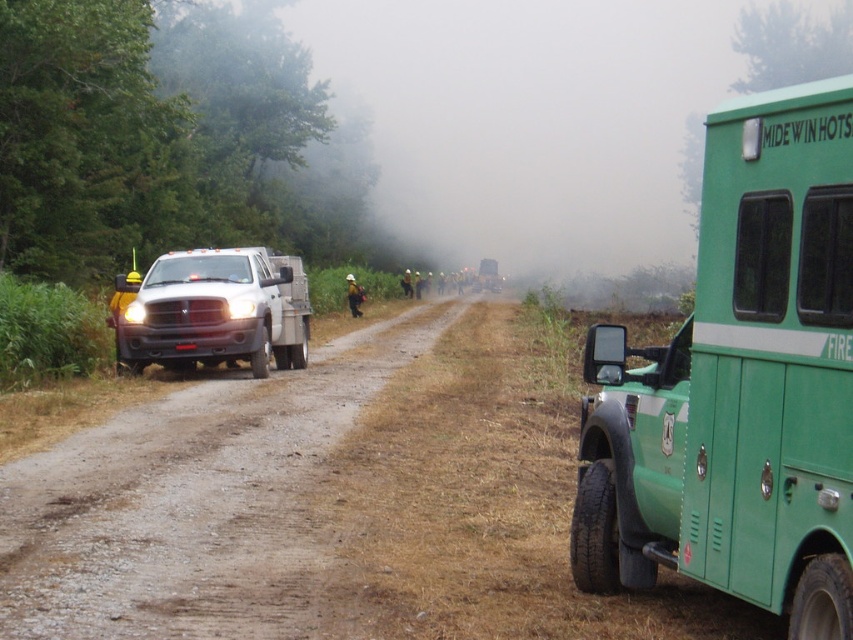
In the scene shown: Is dusty gravel road at center below matte white truck at left?

Indeed, dusty gravel road at center is positioned under matte white truck at left.

Looking at this image, does dusty gravel road at center have a lesser height compared to matte white truck at left?

Correct, dusty gravel road at center is not as tall as matte white truck at left.

Between point (260, 563) and point (207, 316), which one is positioned behind?

The point (207, 316) is behind.

The image size is (853, 640). Identify the location of dusty gravel road at center. click(190, 502).

Which is more to the right, green matte truck at right or matte white truck at left?

green matte truck at right

Is point (712, 468) farther from camera compared to point (206, 323)?

No.

What do you see at coordinates (740, 384) in the screenshot?
I see `green matte truck at right` at bounding box center [740, 384].

Identify the location of green matte truck at right. (740, 384).

Is green matte truck at right to the left of dusty gravel road at center from the viewer's perspective?

Incorrect, green matte truck at right is not on the left side of dusty gravel road at center.

The height and width of the screenshot is (640, 853). Find the location of `green matte truck at right`. green matte truck at right is located at coordinates (740, 384).